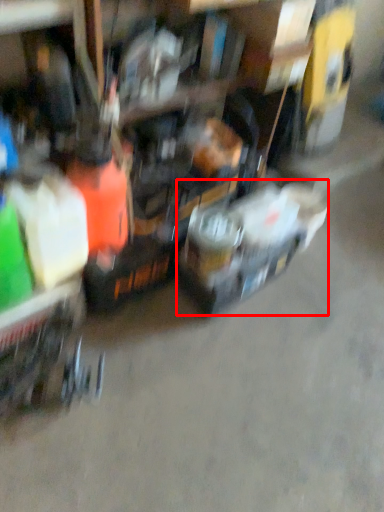
Question: From the image's perspective, where is vehicle (annotated by the red box) located relative to trolley?

Choices:
 (A) above
 (B) below

Answer: (A)